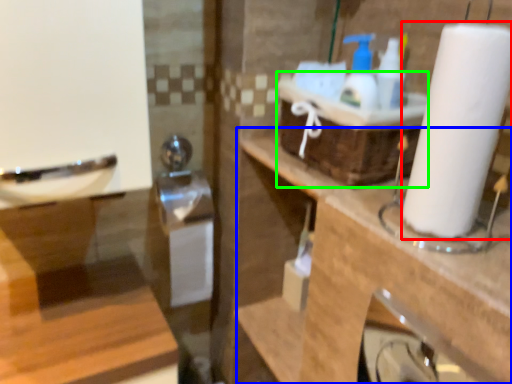
Question: Which object is the farthest from paper towel (highlighted by a red box)? Choose among these: counter top (highlighted by a blue box) or basket (highlighted by a green box).

Choices:
 (A) counter top
 (B) basket

Answer: (A)